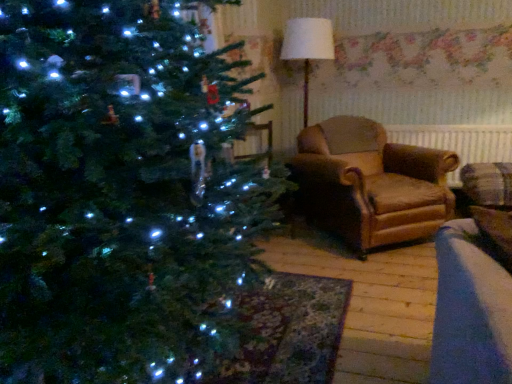
What are the coordinates of `brown fabric radiator at right` in the screenshot? It's located at (458, 142).

Image resolution: width=512 pixels, height=384 pixels. What do you see at coordinates (371, 183) in the screenshot?
I see `leather armchair at center` at bounding box center [371, 183].

This screenshot has width=512, height=384. I want to click on brown fabric radiator at right, so click(x=458, y=142).

From a real-world perspective, which is physically above, leather armchair at center or brown fabric radiator at right?

brown fabric radiator at right.

From the image's perspective, is leather armchair at center beneath brown fabric radiator at right?

Yes.

Which is behind, point (438, 185) or point (408, 132)?

Positioned behind is point (408, 132).

Does point (292, 20) lie in front of point (355, 161)?

No, (292, 20) is further to viewer.

Which of these two, white fabric lampshade at upper center or leather armchair at center, stands taller?

white fabric lampshade at upper center is taller.

Between white fabric lampshade at upper center and leather armchair at center, which one is positioned in front?

leather armchair at center.

Is white fabric lampshade at upper center positioned with its back to leather armchair at center?

No, white fabric lampshade at upper center's orientation is not away from leather armchair at center.

Would you say brown fabric radiator at right is a long distance from leather armchair at center?

brown fabric radiator at right is near leather armchair at center, not far away.

Where is `studio couch below the brown fabric radiator at right (from a real-world perspective)`? The height and width of the screenshot is (384, 512). studio couch below the brown fabric radiator at right (from a real-world perspective) is located at coordinates (371, 183).

Considering the sizes of brown fabric radiator at right and leather armchair at center in the image, is brown fabric radiator at right wider or thinner than leather armchair at center?

brown fabric radiator at right is thinner than leather armchair at center.

Considering the relative sizes of white fabric lampshade at upper center and brown fabric radiator at right in the image provided, is white fabric lampshade at upper center thinner than brown fabric radiator at right?

No, white fabric lampshade at upper center is not thinner than brown fabric radiator at right.

Image resolution: width=512 pixels, height=384 pixels. In the image, there is a white fabric lampshade at upper center. Find the location of `radiator below it (from a real-world perspective)`. radiator below it (from a real-world perspective) is located at coordinates (458, 142).

From a real-world perspective, who is located lower, white fabric lampshade at upper center or brown fabric radiator at right?

In real-world perspective, brown fabric radiator at right is lower.

Can you confirm if leather armchair at center is bigger than white fabric lampshade at upper center?

Yes, leather armchair at center is bigger than white fabric lampshade at upper center.

From a real-world perspective, which is physically above, leather armchair at center or white fabric lampshade at upper center?

white fabric lampshade at upper center is physically above.

Is leather armchair at center spatially inside white fabric lampshade at upper center, or outside of it?

leather armchair at center is located beyond the bounds of white fabric lampshade at upper center.

Between brown fabric radiator at right and white fabric lampshade at upper center, which one has larger size?

white fabric lampshade at upper center is bigger.

Does brown fabric radiator at right appear on the left side of white fabric lampshade at upper center?

No.

Is point (432, 127) farther from camera compared to point (289, 21)?

Yes, it is behind point (289, 21).

You are a GUI agent. You are given a task and a screenshot of the screen. Output one action in this format:
    pyautogui.click(x=<x>, y=<y>)
    Task: Click on the studio couch directly beneath the brown fabric radiator at right (from a real-world perspective)
    The height and width of the screenshot is (384, 512).
    Given the screenshot: What is the action you would take?
    coord(371,183)

Find the location of a particular element. This screenshot has height=384, width=512. studio couch below the white fabric lampshade at upper center (from the image's perspective) is located at coordinates (371, 183).

From the image, which object appears to be nearer to leather armchair at center, white fabric lampshade at upper center or brown fabric radiator at right?

brown fabric radiator at right is closer to leather armchair at center.

Looking at this image, based on their spatial positions, is brown fabric radiator at right or leather armchair at center closer to white fabric lampshade at upper center?

Among the two, leather armchair at center is located nearer to white fabric lampshade at upper center.

From the image, which object appears to be nearer to brown fabric radiator at right, white fabric lampshade at upper center or leather armchair at center?

leather armchair at center.

From the image, which object appears to be nearer to leather armchair at center, brown fabric radiator at right or white fabric lampshade at upper center?

brown fabric radiator at right is positioned closer to the anchor leather armchair at center.

Looking at the image, which one is located closer to white fabric lampshade at upper center, leather armchair at center or brown fabric radiator at right?

The object closer to white fabric lampshade at upper center is leather armchair at center.

Looking at the image, which one is located closer to brown fabric radiator at right, leather armchair at center or white fabric lampshade at upper center?

leather armchair at center.

The height and width of the screenshot is (384, 512). I want to click on studio couch located between white fabric lampshade at upper center and brown fabric radiator at right in the left-right direction, so click(x=371, y=183).